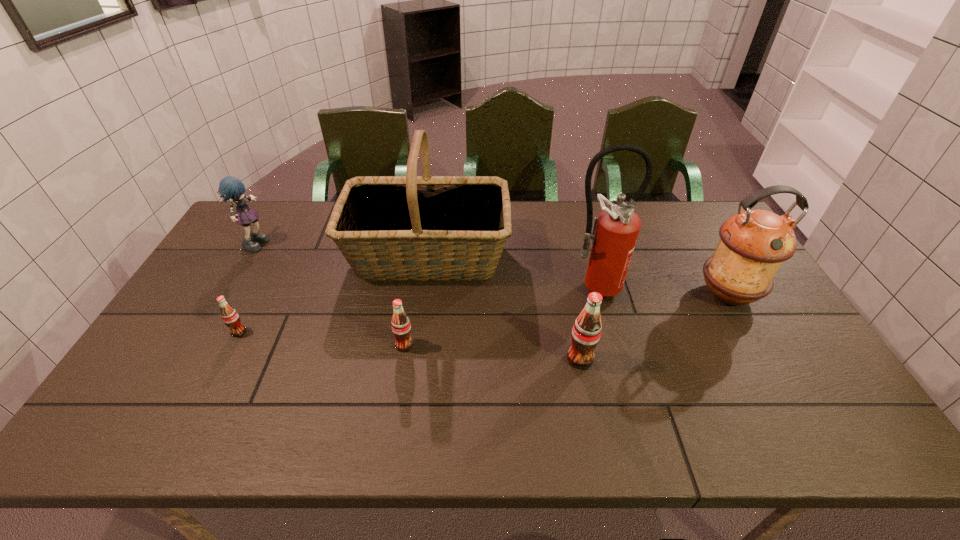
Locate an element on the screen. The width and height of the screenshot is (960, 540). vacant space located 0.060m on the front of the second tallest soda is located at coordinates (400, 372).

At what (x,y) coordinates should I click in order to perform the action: click on vacant space located 0.100m on the right of the tallest soda. Please return your answer as a coordinate pair (x, y). The height and width of the screenshot is (540, 960). Looking at the image, I should click on (632, 359).

The width and height of the screenshot is (960, 540). Find the location of `vacant area located 0.220m by the handle of the basket`. vacant area located 0.220m by the handle of the basket is located at coordinates (575, 255).

At what (x,y) coordinates should I click in order to perform the action: click on vacant space located on the front-facing side of the rag doll. Please return your answer as a coordinate pair (x, y). The width and height of the screenshot is (960, 540). Looking at the image, I should click on (353, 242).

The width and height of the screenshot is (960, 540). I want to click on vacant region located on the left of the oil lamp, so click(x=622, y=294).

Locate an element on the screen. Image resolution: width=960 pixels, height=540 pixels. vacant space located 0.320m at the nozzle of the fire extinguisher is located at coordinates (623, 401).

Where is `basket present at the far edge`? This screenshot has width=960, height=540. basket present at the far edge is located at coordinates (411, 227).

I want to click on rag doll located at the far edge, so click(x=230, y=187).

Locate an element on the screen. The width and height of the screenshot is (960, 540). object present at the left edge is located at coordinates (230, 187).

At what (x,y) coordinates should I click in order to perform the action: click on object at the right edge. Please return your answer as a coordinate pair (x, y). The width and height of the screenshot is (960, 540). Looking at the image, I should click on (753, 244).